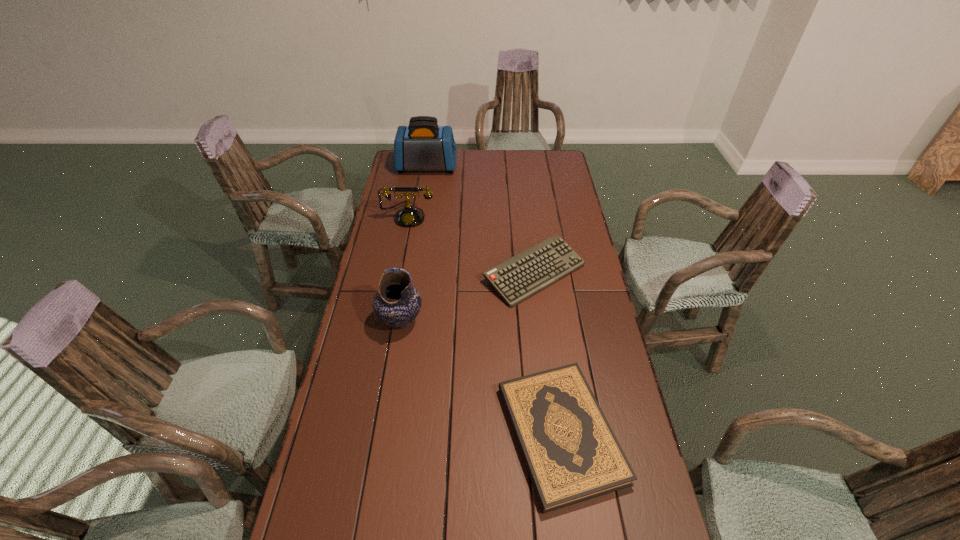
Find the location of a particular element. vacant position at the far edge of the desktop is located at coordinates (525, 172).

In the image, there is a desktop. Where is `vacant space at the left edge`? This screenshot has width=960, height=540. vacant space at the left edge is located at coordinates (419, 208).

I want to click on vacant space at the far right corner, so click(541, 167).

Where is `free spot between the tallest object and the hardback book`? The width and height of the screenshot is (960, 540). free spot between the tallest object and the hardback book is located at coordinates (493, 300).

The image size is (960, 540). I want to click on empty location between the nearest object and the computer keyboard, so click(x=547, y=354).

The height and width of the screenshot is (540, 960). I want to click on vacant region between the second farthest object and the second shortest object, so click(x=471, y=245).

The width and height of the screenshot is (960, 540). Identify the location of free space between the pottery and the hardback book. (481, 377).

The image size is (960, 540). I want to click on free area in between the toaster and the computer keyboard, so click(x=481, y=220).

The width and height of the screenshot is (960, 540). What are the coordinates of `unoccupied position between the toaster and the hardback book` in the screenshot? It's located at click(493, 300).

Where is `empty space that is in between the pottery and the farthest object`? The width and height of the screenshot is (960, 540). empty space that is in between the pottery and the farthest object is located at coordinates (414, 244).